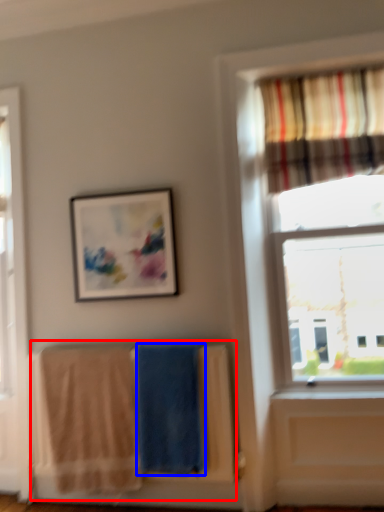
Question: Which object appears farthest to the camera in this image, laundry (highlighted by a red box) or beach towel (highlighted by a blue box)?

Choices:
 (A) laundry
 (B) beach towel

Answer: (B)